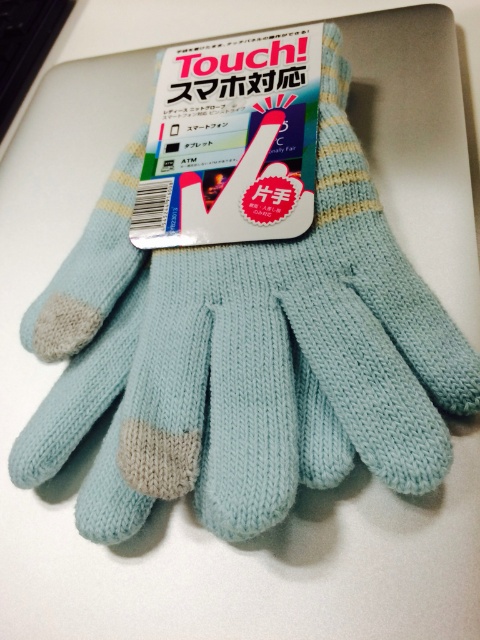
Question: From the image, what is the correct spatial relationship of matte blue knitted gloves at center in relation to black plastic keyboard at upper left?

Choices:
 (A) above
 (B) below

Answer: (B)

Question: Does matte blue knitted gloves at center have a greater width compared to black plastic keyboard at upper left?

Choices:
 (A) yes
 (B) no

Answer: (A)

Question: Which point is closer to the camera?

Choices:
 (A) (39, 76)
 (B) (300, 108)

Answer: (B)

Question: Where is matte blue knitted gloves at center located in relation to black plastic keyboard at upper left in the image?

Choices:
 (A) below
 (B) above

Answer: (A)

Question: Which of the following is the closest to the observer?

Choices:
 (A) (3, 140)
 (B) (279, 116)

Answer: (B)